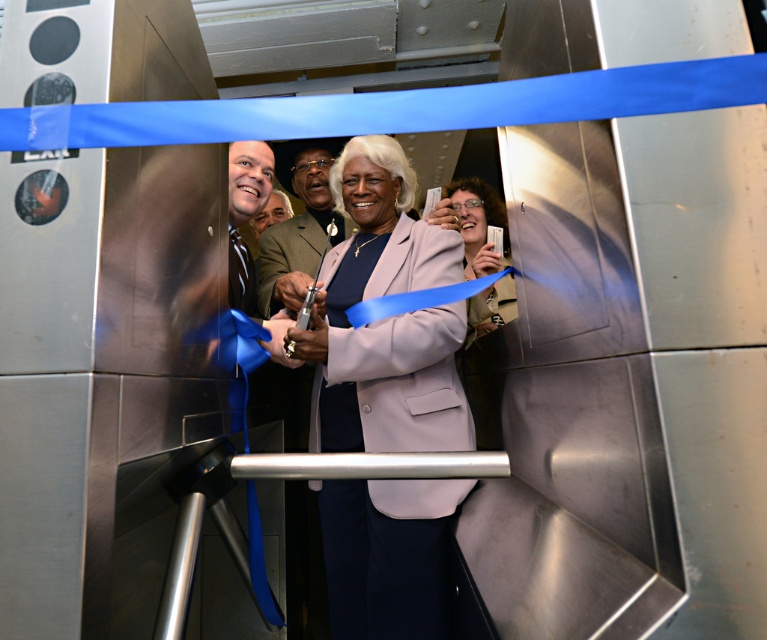
What do you see at coordinates (298, 224) in the screenshot?
I see `light brown leather jacket at center` at bounding box center [298, 224].

In the scene shown: Between light brown leather jacket at center and matte purple jacket at center, which one is positioned lower?

light brown leather jacket at center

Does point (272, 278) lie behind point (486, 243)?

Yes, it is.

Where is `light brown leather jacket at center`? light brown leather jacket at center is located at coordinates (298, 224).

Can you confirm if matte pink blazer at center is positioned to the right of matte purple jacket at center?

In fact, matte pink blazer at center is to the left of matte purple jacket at center.

Measure the distance between matte pink blazer at center and matte purple jacket at center.

matte pink blazer at center and matte purple jacket at center are 15.09 inches apart.

Describe the element at coordinates (384, 320) in the screenshot. The image size is (767, 640). I see `matte pink blazer at center` at that location.

Where is `matte pink blazer at center`? The image size is (767, 640). matte pink blazer at center is located at coordinates (384, 320).

Can you confirm if matte pink blazer at center is smaller than light brown leather jacket at center?

Yes, matte pink blazer at center is smaller than light brown leather jacket at center.

Who is positioned more to the left, matte pink blazer at center or light brown leather jacket at center?

From the viewer's perspective, light brown leather jacket at center appears more on the left side.

Describe the element at coordinates (384, 320) in the screenshot. I see `matte pink blazer at center` at that location.

This screenshot has width=767, height=640. In order to click on matte pink blazer at center in this screenshot , I will do `click(384, 320)`.